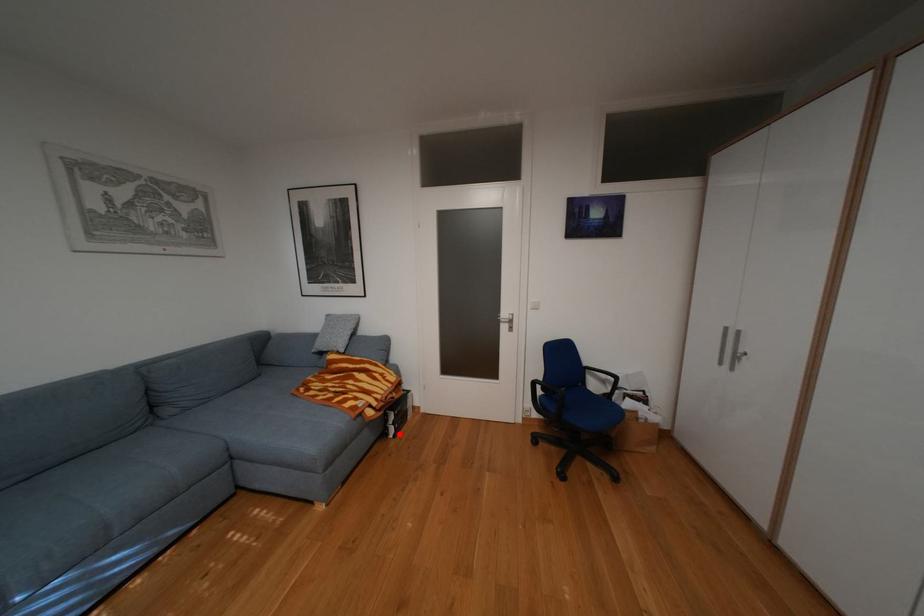
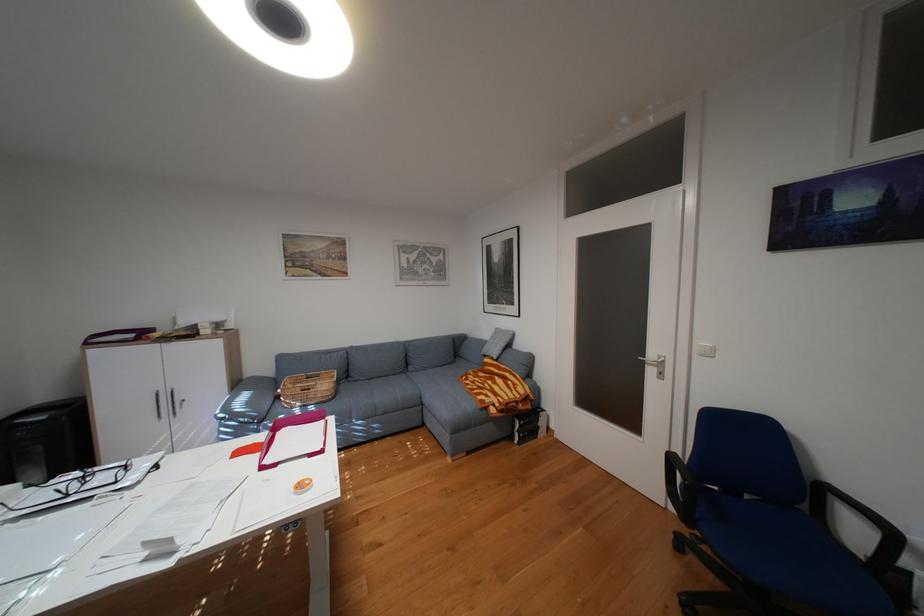
Question: I am providing you with two images of the same scene from different viewpoints. In image1, a red point is highlighted. Considering the same 3D point in image2, which of the following is correct?

Choices:
 (A) It is closer
 (B) It is farther

Answer: (B)